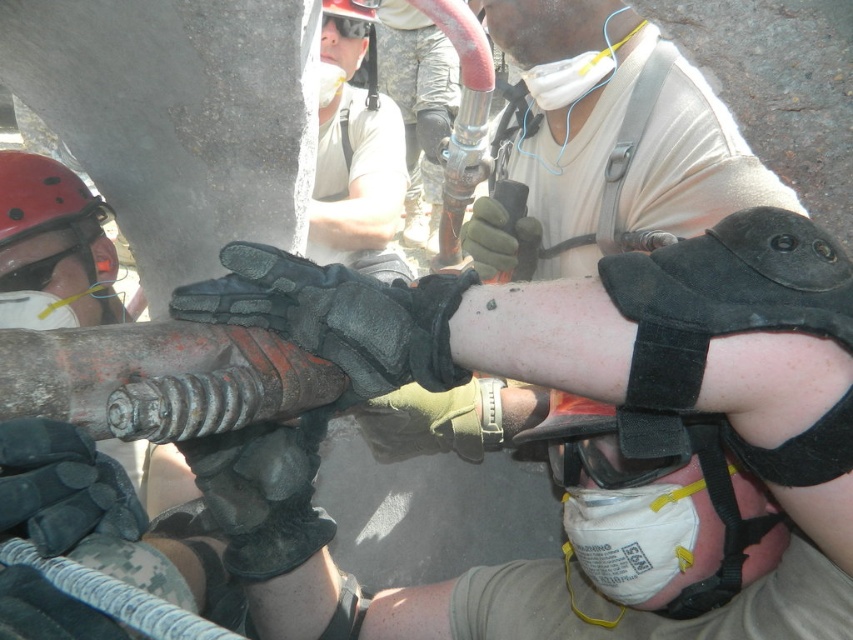
You are a safety inspector evaluating the equipment in the scene. The red matte helmet at left and black leather gloves at center are both critical for safety. Based on the provided scene description, which piece of equipment has a greater width?

The red matte helmet at left has a greater width than the black leather gloves at center.

You are a safety inspector assessing the scene. You notice the red matte helmet at left and the black leather gloves at center. Which object is higher in vertical position?

The red matte helmet at left is taller than the black leather gloves at center, so the red matte helmet at left is higher in vertical position.